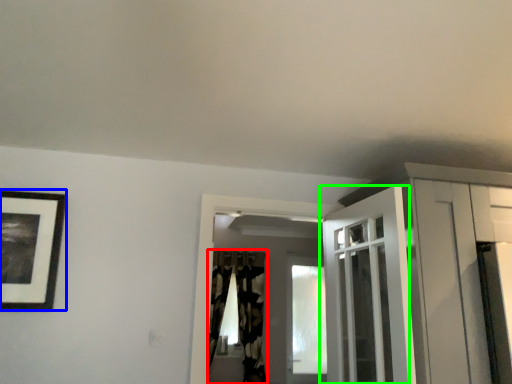
Question: Which is farther away from curtain (highlighted by a red box)? picture frame (highlighted by a blue box) or door (highlighted by a green box)?

Choices:
 (A) picture frame
 (B) door

Answer: (A)